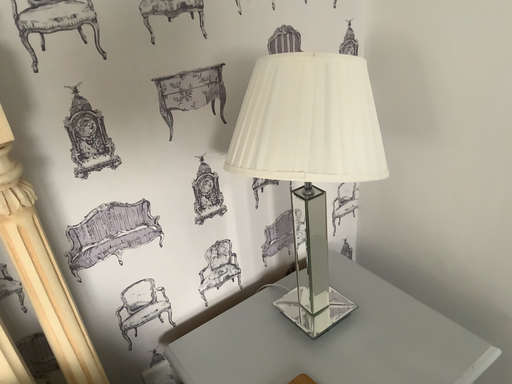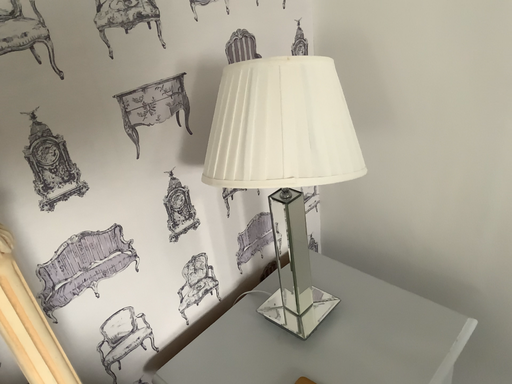
Question: Which way did the camera rotate in the video?

Choices:
 (A) rotated right
 (B) rotated left

Answer: (A)